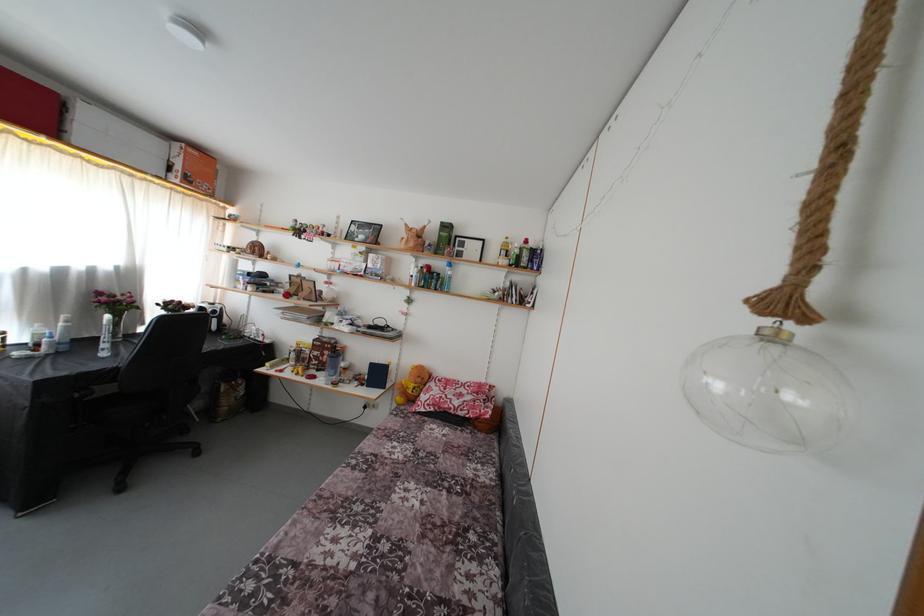
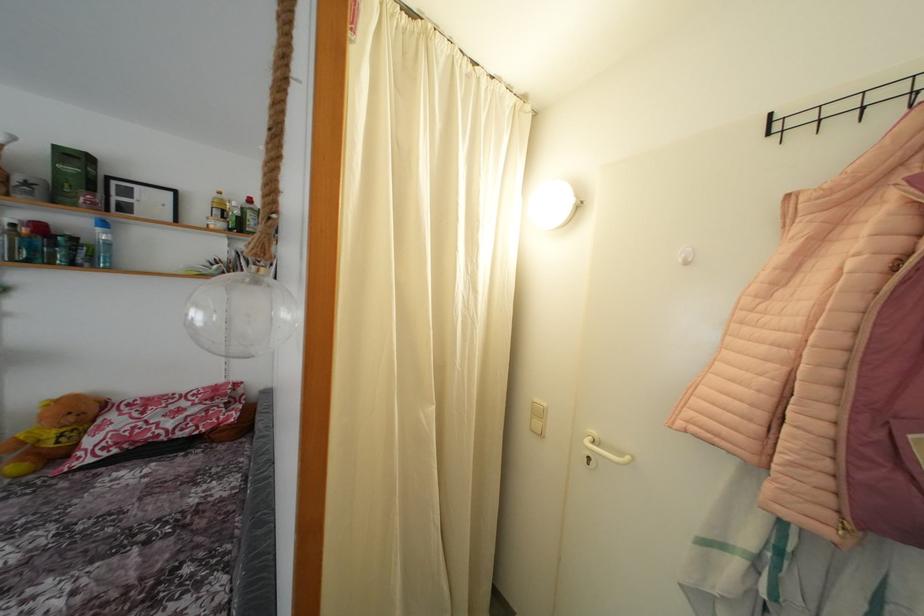
In the second image, find the point that corresponds to pixel 538 312 in the first image.

(281, 286)